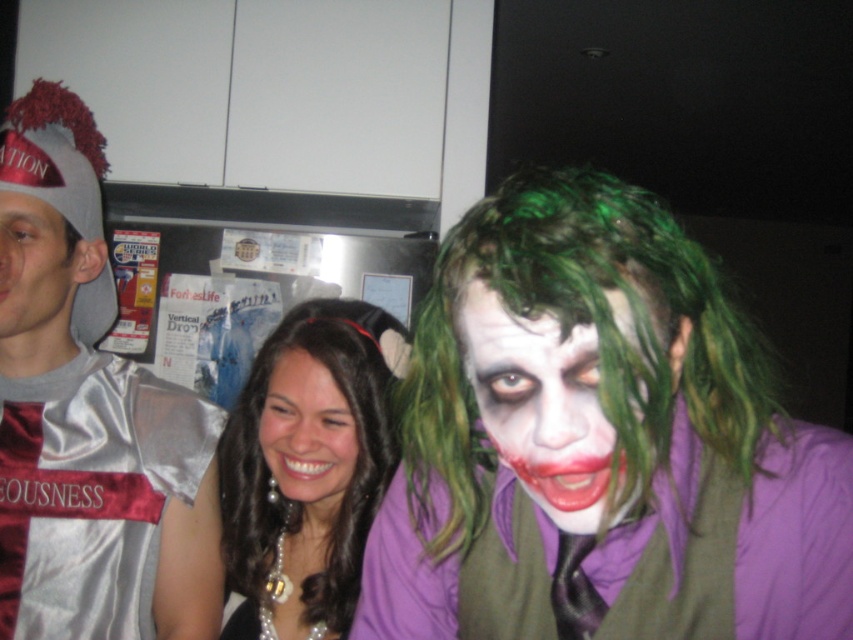
Question: Among these objects, which one is nearest to the camera?

Choices:
 (A) black pearl necklace at center
 (B) green matte wig at center
 (C) green matte wig at upper right
 (D) silver satin jersey at left

Answer: (B)

Question: Is black pearl necklace at center bigger than matte gray face at left?

Choices:
 (A) no
 (B) yes

Answer: (B)

Question: Which of these objects is positioned farthest from the green matte wig at upper right?

Choices:
 (A) green synthetic wig at right
 (B) black pearl necklace at center
 (C) green matte wig at center

Answer: (B)

Question: Which point appears closest to the camera in this image?

Choices:
 (A) (x=711, y=406)
 (B) (x=491, y=513)
 (C) (x=271, y=378)

Answer: (A)

Question: Does black pearl necklace at center appear under green matte wig at center?

Choices:
 (A) no
 (B) yes

Answer: (B)

Question: Is silver satin jersey at left wider than green matte wig at upper right?

Choices:
 (A) no
 (B) yes

Answer: (A)